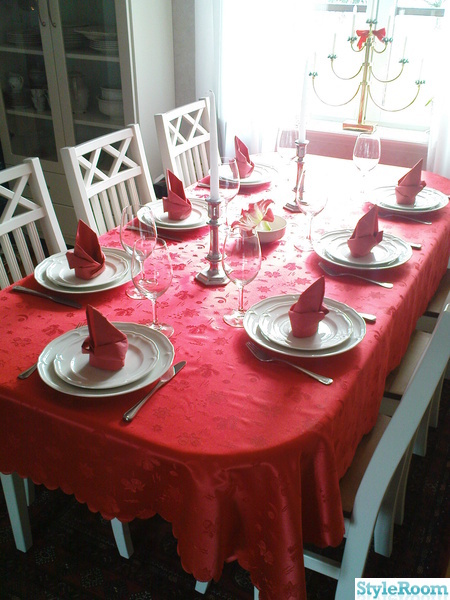
This screenshot has width=450, height=600. What are the coordinates of `small or salad plate` in the screenshot? It's located at (324, 332), (376, 254), (423, 203), (255, 175), (193, 217), (104, 274), (130, 368).